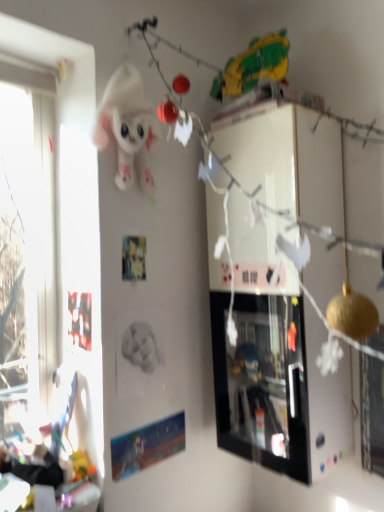
What do you see at coordinates (262, 381) in the screenshot?
I see `black glossy picture frame at upper center` at bounding box center [262, 381].

What is the approximate width of black glossy picture frame at upper center?

black glossy picture frame at upper center is 32.58 centimeters wide.

Identify the location of black glossy picture frame at upper center. (262, 381).

The width and height of the screenshot is (384, 512). I want to click on white plush toy at upper center, so click(127, 127).

This screenshot has height=512, width=384. What do you see at coordinates (127, 127) in the screenshot?
I see `white plush toy at upper center` at bounding box center [127, 127].

The height and width of the screenshot is (512, 384). Find the location of `black glossy picture frame at upper center`. black glossy picture frame at upper center is located at coordinates (262, 381).

Considering the positions of objects black glossy picture frame at upper center and white plush toy at upper center in the image provided, who is more to the right, black glossy picture frame at upper center or white plush toy at upper center?

black glossy picture frame at upper center is more to the right.

Which object is closer to the camera, black glossy picture frame at upper center or white plush toy at upper center?

Positioned in front is white plush toy at upper center.

Considering the points (218, 343) and (124, 65), which point is behind, point (218, 343) or point (124, 65)?

The point (218, 343) is farther from the camera.

From the image's perspective, which is above, black glossy picture frame at upper center or white plush toy at upper center?

white plush toy at upper center.

From a real-world perspective, is black glossy picture frame at upper center on white plush toy at upper center?

No.

Is black glossy picture frame at upper center wider or thinner than white plush toy at upper center?

Clearly, black glossy picture frame at upper center has more width compared to white plush toy at upper center.

Is black glossy picture frame at upper center taller or shorter than white plush toy at upper center?

black glossy picture frame at upper center is taller than white plush toy at upper center.

In terms of size, does black glossy picture frame at upper center appear bigger or smaller than white plush toy at upper center?

Clearly, black glossy picture frame at upper center is larger in size than white plush toy at upper center.

Is black glossy picture frame at upper center inside or outside of white plush toy at upper center?

black glossy picture frame at upper center is spatially situated outside white plush toy at upper center.

Is the surface of black glossy picture frame at upper center in direct contact with white plush toy at upper center?

There is a gap between black glossy picture frame at upper center and white plush toy at upper center.

Is black glossy picture frame at upper center positioned with its back to white plush toy at upper center?

No.

Find the location of a particular element. The height and width of the screenshot is (512, 384). toy above the black glossy picture frame at upper center (from the image's perspective) is located at coordinates (127, 127).

Which is more to the right, white plush toy at upper center or black glossy picture frame at upper center?

From the viewer's perspective, black glossy picture frame at upper center appears more on the right side.

Is white plush toy at upper center in front of or behind black glossy picture frame at upper center in the image?

Clearly, white plush toy at upper center is in front of black glossy picture frame at upper center.

Between point (111, 126) and point (283, 383), which one is positioned behind?

Point (283, 383)

From the image's perspective, is white plush toy at upper center located beneath black glossy picture frame at upper center?

Actually, white plush toy at upper center appears above black glossy picture frame at upper center in the image.

From a real-world perspective, does white plush toy at upper center sit lower than black glossy picture frame at upper center?

Actually, white plush toy at upper center is physically above black glossy picture frame at upper center in the real world.

Is white plush toy at upper center wider than black glossy picture frame at upper center?

No.

Who is shorter, white plush toy at upper center or black glossy picture frame at upper center?

white plush toy at upper center is shorter.

Is white plush toy at upper center bigger than black glossy picture frame at upper center?

No.

Is white plush toy at upper center positioned beyond the bounds of black glossy picture frame at upper center?

white plush toy at upper center is positioned outside black glossy picture frame at upper center.

Are white plush toy at upper center and black glossy picture frame at upper center beside each other?

No, white plush toy at upper center is not in contact with black glossy picture frame at upper center.

Could you tell me if white plush toy at upper center is turned towards black glossy picture frame at upper center?

No, white plush toy at upper center is not oriented towards black glossy picture frame at upper center.

In the scene shown: How different are the orientations of white plush toy at upper center and black glossy picture frame at upper center in degrees?

The angular difference between white plush toy at upper center and black glossy picture frame at upper center is 91.9 degrees.

The width and height of the screenshot is (384, 512). Identify the location of toy above the black glossy picture frame at upper center (from a real-world perspective). (127, 127).

Where is `picture frame below the white plush toy at upper center (from a real-world perspective)`? The image size is (384, 512). picture frame below the white plush toy at upper center (from a real-world perspective) is located at coordinates point(262,381).

Find the location of a particular element. toy above the black glossy picture frame at upper center (from the image's perspective) is located at coordinates (x=127, y=127).